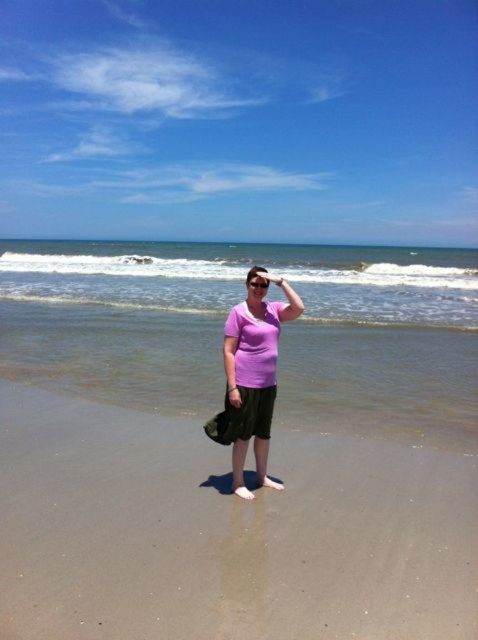
How far apart are smooth sand at center and pink matte shirt at center?

A distance of 1.10 meters exists between smooth sand at center and pink matte shirt at center.

Is smooth sand at center shorter than pink matte shirt at center?

Indeed, smooth sand at center has a lesser height compared to pink matte shirt at center.

Which is in front, point (218, 493) or point (212, 428)?

Point (212, 428) is more forward.

Where is `smooth sand at center`? smooth sand at center is located at coordinates (225, 532).

Does blue water at center lie in front of pink matte shirt at center?

No, blue water at center is further to the viewer.

Who is shorter, blue water at center or pink matte shirt at center?

pink matte shirt at center is shorter.

Which is in front, point (69, 296) or point (234, 349)?

Point (234, 349) is more forward.

I want to click on blue water at center, so click(x=243, y=276).

Who is positioned more to the right, smooth sand at center or blue water at center?

blue water at center

Does point (65, 572) lie in front of point (105, 282)?

Yes.

Find the location of a particular element. The height and width of the screenshot is (640, 478). smooth sand at center is located at coordinates (225, 532).